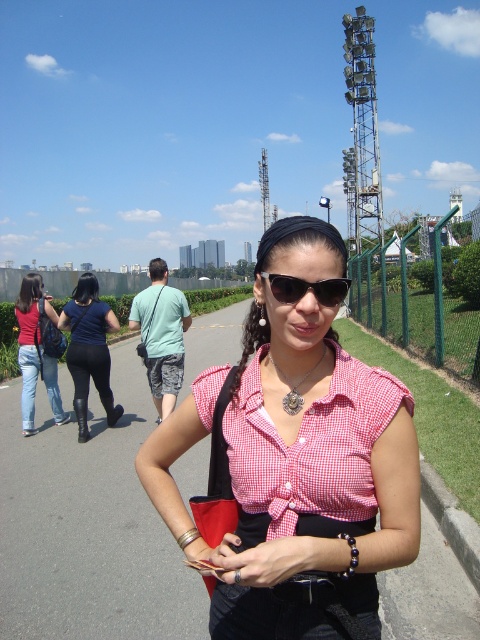
Question: Is black leather boots at left below sunglasses at center?

Choices:
 (A) yes
 (B) no

Answer: (B)

Question: Among these objects, which one is farthest from the camera?

Choices:
 (A) denim jeans at left
 (B) sunglasses at center

Answer: (A)

Question: Which point is closer to the camera?

Choices:
 (A) (338, 300)
 (B) (301, 380)
 (C) (103, 310)

Answer: (A)

Question: Which object appears closest to the camera in this image?

Choices:
 (A) sunglasses at center
 (B) black leather boots at left
 (C) silver metallic pendant at center

Answer: (A)

Question: Can you confirm if pink checkered shirt at center is positioned to the right of sunglasses at center?

Choices:
 (A) yes
 (B) no

Answer: (B)

Question: Can you confirm if denim jeans at left is positioned above silver metallic pendant at center?

Choices:
 (A) yes
 (B) no

Answer: (B)